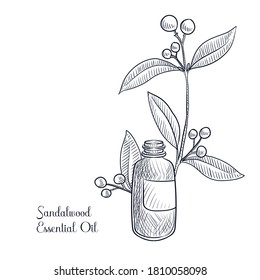
Locate an element on the screen. The height and width of the screenshot is (280, 260). bottle is located at coordinates (143, 226).